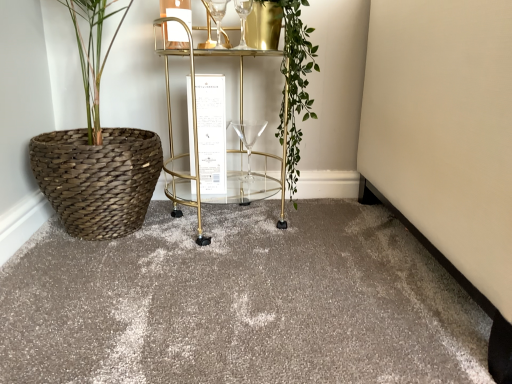
Question: Is clear glass wine glass at upper center, arranged as the second wine glass when viewed from the back, facing away from matte gray carpet at center?

Choices:
 (A) yes
 (B) no

Answer: (B)

Question: Does clear glass wine glass at upper center, the second wine glass in the bottom-to-top sequence, turn towards matte gray carpet at center?

Choices:
 (A) yes
 (B) no

Answer: (B)

Question: Can you confirm if clear glass wine glass at upper center, the second wine glass in the bottom-to-top sequence, is shorter than matte gray carpet at center?

Choices:
 (A) yes
 (B) no

Answer: (B)

Question: From the image's perspective, is clear glass wine glass at upper center, the first wine glass positioned from the top, below matte gray carpet at center?

Choices:
 (A) yes
 (B) no

Answer: (B)

Question: Does clear glass wine glass at upper center, arranged as the second wine glass when viewed from the back, lie in front of matte gray carpet at center?

Choices:
 (A) yes
 (B) no

Answer: (B)

Question: Considering the relative sizes of transparent glass wine glass at center, the first wine glass viewed from the back, and gold metallic bar cart at center in the image provided, is transparent glass wine glass at center, the first wine glass viewed from the back, shorter than gold metallic bar cart at center?

Choices:
 (A) yes
 (B) no

Answer: (A)

Question: Can you confirm if transparent glass wine glass at center, arranged as the 2th wine glass when viewed from the top, is smaller than gold metallic bar cart at center?

Choices:
 (A) yes
 (B) no

Answer: (A)

Question: Considering the relative positions of transparent glass wine glass at center, arranged as the 2th wine glass when viewed from the top, and gold metallic bar cart at center in the image provided, is transparent glass wine glass at center, arranged as the 2th wine glass when viewed from the top, to the left of gold metallic bar cart at center from the viewer's perspective?

Choices:
 (A) yes
 (B) no

Answer: (B)

Question: Considering the relative positions of transparent glass wine glass at center, arranged as the 2th wine glass when viewed from the top, and gold metallic bar cart at center in the image provided, is transparent glass wine glass at center, arranged as the 2th wine glass when viewed from the top, to the right of gold metallic bar cart at center from the viewer's perspective?

Choices:
 (A) no
 (B) yes

Answer: (B)

Question: Is transparent glass wine glass at center, arranged as the 2th wine glass when viewed from the top, turned away from gold metallic bar cart at center?

Choices:
 (A) yes
 (B) no

Answer: (A)

Question: Is transparent glass wine glass at center, the first wine glass viewed from the back, placed right next to gold metallic bar cart at center?

Choices:
 (A) yes
 (B) no

Answer: (B)

Question: Could you tell me if matte gray carpet at center is turned towards clear glass wine glass at upper center, marked as the 1th wine glass in a front-to-back arrangement?

Choices:
 (A) no
 (B) yes

Answer: (A)